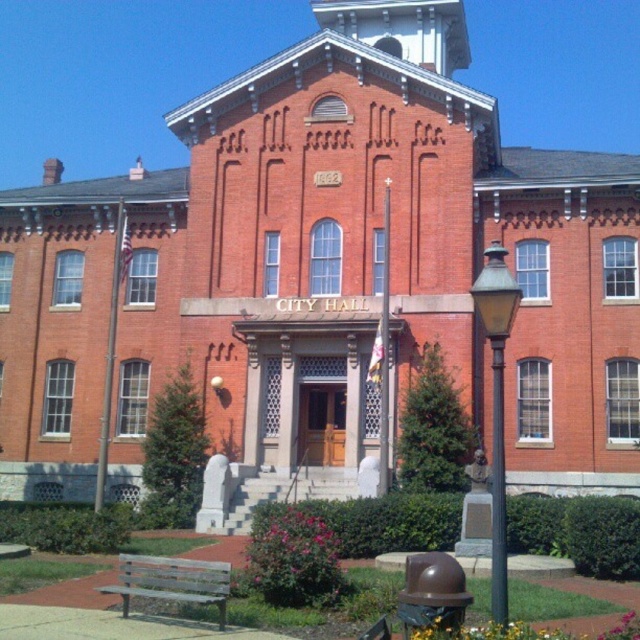
Which is behind, point (502, 584) or point (154, 586)?

The point (154, 586) is more distant.

Is point (500, 380) less distant than point (177, 576)?

No, it is not.

I want to click on matte black lamp post at lower right, so click(x=497, y=403).

Does metallic pole at right have a smaller size compared to metallic pole at left?

Incorrect, metallic pole at right is not smaller in size than metallic pole at left.

Can you confirm if metallic pole at right is wider than metallic pole at left?

Correct, the width of metallic pole at right exceeds that of metallic pole at left.

Where is `metallic pole at right`? metallic pole at right is located at coordinates (497, 486).

I want to click on metallic pole at right, so click(497, 486).

Who is more forward, (227, 595) or (499, 496)?

Point (499, 496)

Who is higher up, wooden bench at lower left or metallic pole at right?

Positioned higher is metallic pole at right.

Does point (106, 586) come behind point (496, 621)?

Yes.

Find the location of a particular element. The width and height of the screenshot is (640, 640). wooden bench at lower left is located at coordinates (172, 580).